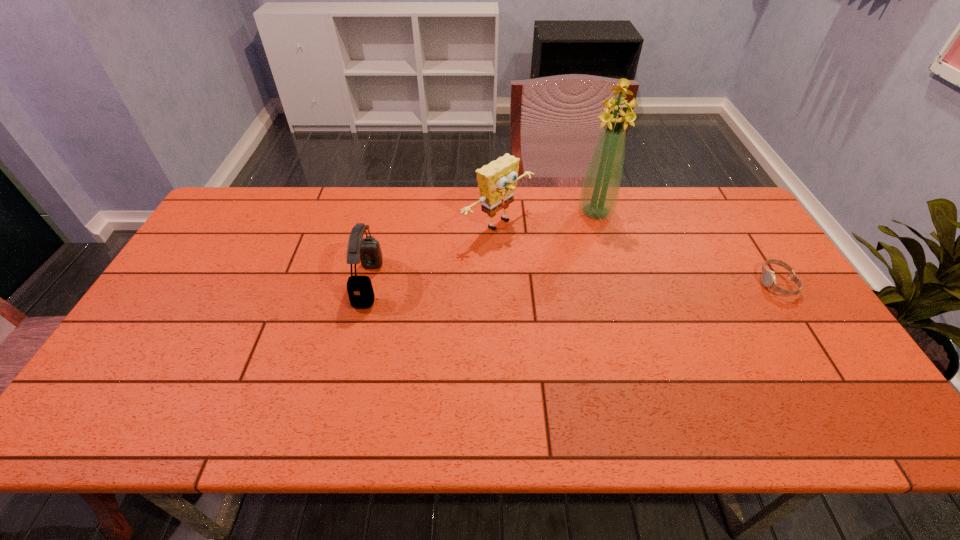
The image size is (960, 540). Identify the location of headset. (367, 250).

Find the location of `the third tallest object`. the third tallest object is located at coordinates (367, 250).

The image size is (960, 540). Find the location of `the rightmost object`. the rightmost object is located at coordinates (768, 276).

Locate an element on the screen. This screenshot has width=960, height=540. the shortest object is located at coordinates (768, 276).

I want to click on the third object from left to right, so click(600, 189).

Identify the location of bouquet. (600, 189).

Locate an element on the screen. the second object from left to right is located at coordinates (497, 181).

Find the location of a particular element. The height and width of the screenshot is (540, 960). vacant area situated on the headband of the third tallest object is located at coordinates (267, 284).

Identify the location of vacant space located 0.090m on the headband of the third tallest object. This screenshot has height=540, width=960. (326, 284).

This screenshot has width=960, height=540. I want to click on vacant position located 0.050m on the headband of the third tallest object, so click(341, 284).